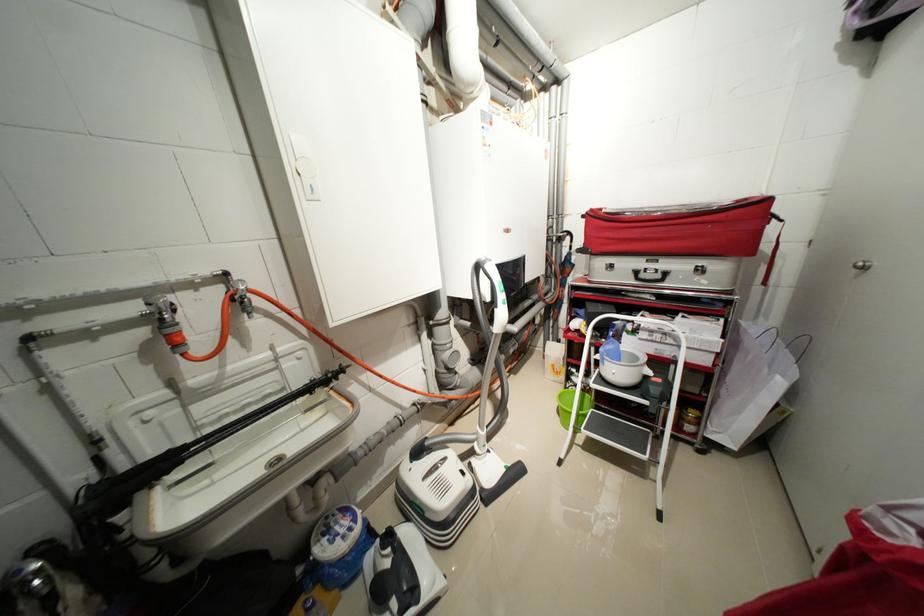
The height and width of the screenshot is (616, 924). I want to click on orange hose connector, so click(x=176, y=339).